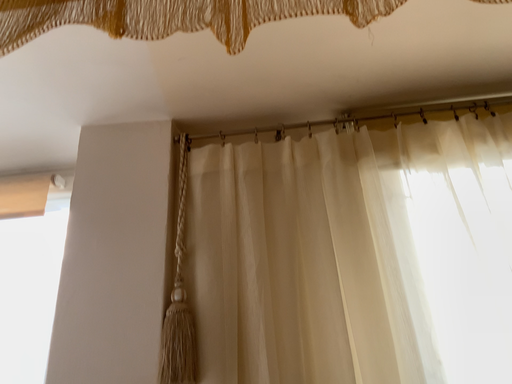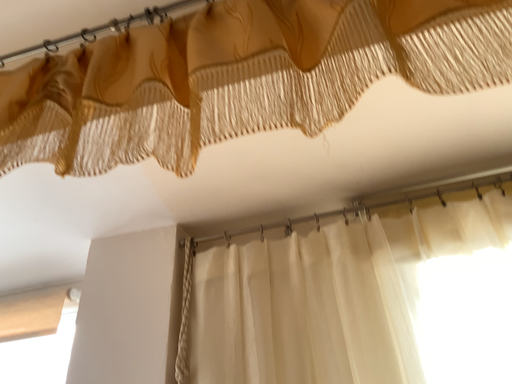
Question: How did the camera likely rotate when shooting the video?

Choices:
 (A) rotated upward
 (B) rotated downward

Answer: (A)